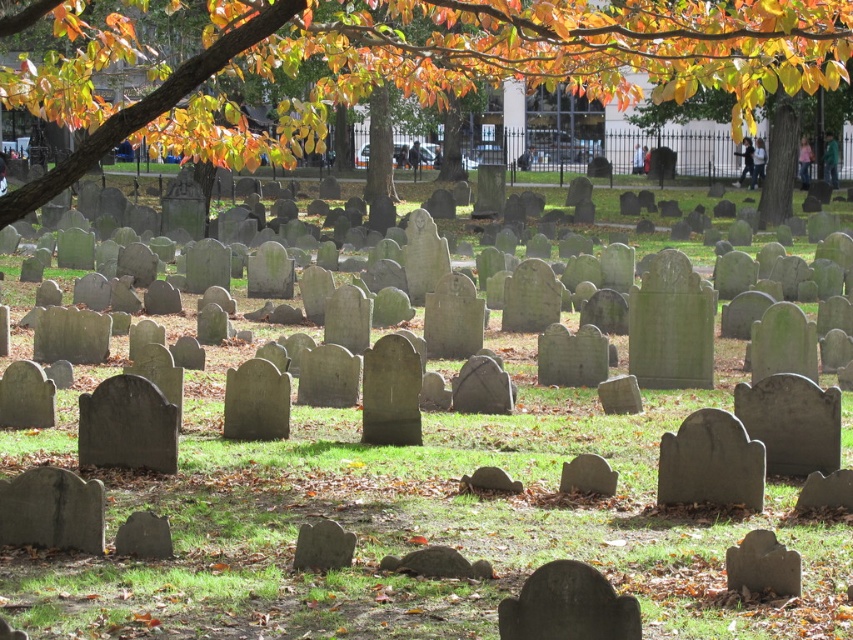
Question: Which point is closer to the camera taking this photo?

Choices:
 (A) (281, 36)
 (B) (846, 49)

Answer: (B)

Question: Is autumn leaves at upper center to the right of yellow-green leaves at upper center from the viewer's perspective?

Choices:
 (A) no
 (B) yes

Answer: (A)

Question: Which point is closer to the camera?

Choices:
 (A) autumn leaves at upper center
 (B) yellow-green leaves at upper center

Answer: (B)

Question: Which point appears closest to the camera in this image?

Choices:
 (A) (749, 1)
 (B) (540, 38)

Answer: (A)

Question: Does autumn leaves at upper center appear on the right side of yellow-green leaves at upper center?

Choices:
 (A) no
 (B) yes

Answer: (A)

Question: Can you confirm if autumn leaves at upper center is wider than yellow-green leaves at upper center?

Choices:
 (A) yes
 (B) no

Answer: (A)